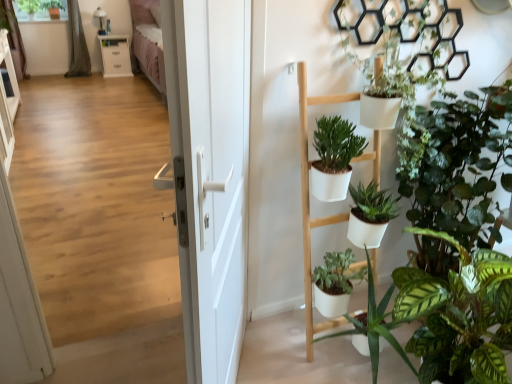
The height and width of the screenshot is (384, 512). I want to click on vacant space underneath wooden floor at center (from a real-world perspective), so click(126, 337).